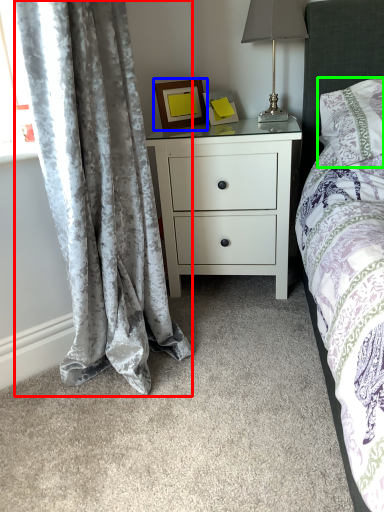
Question: Considering the real-world distances, which object is closest to curtain (highlighted by a red box)? picture frame (highlighted by a blue box) or pillow (highlighted by a green box).

Choices:
 (A) picture frame
 (B) pillow

Answer: (A)